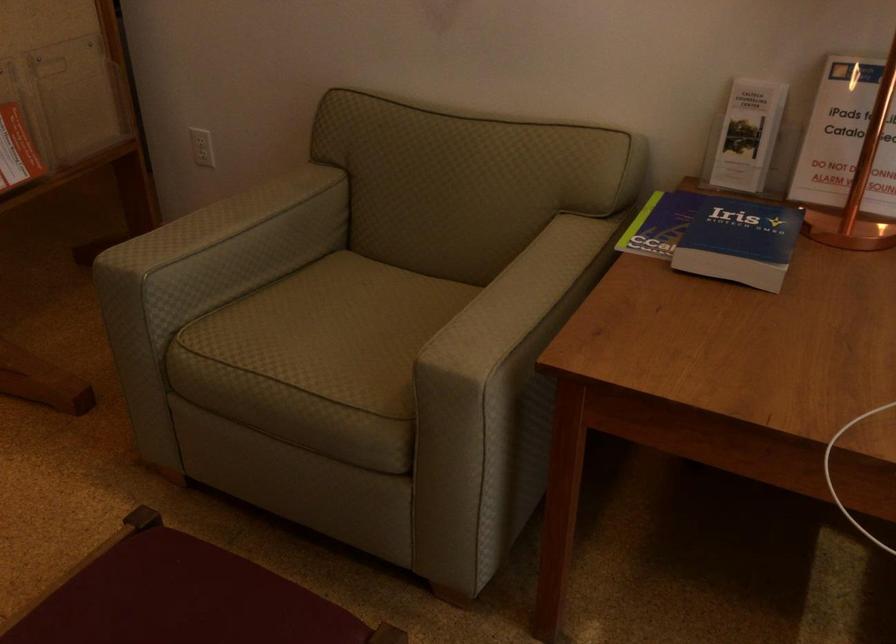
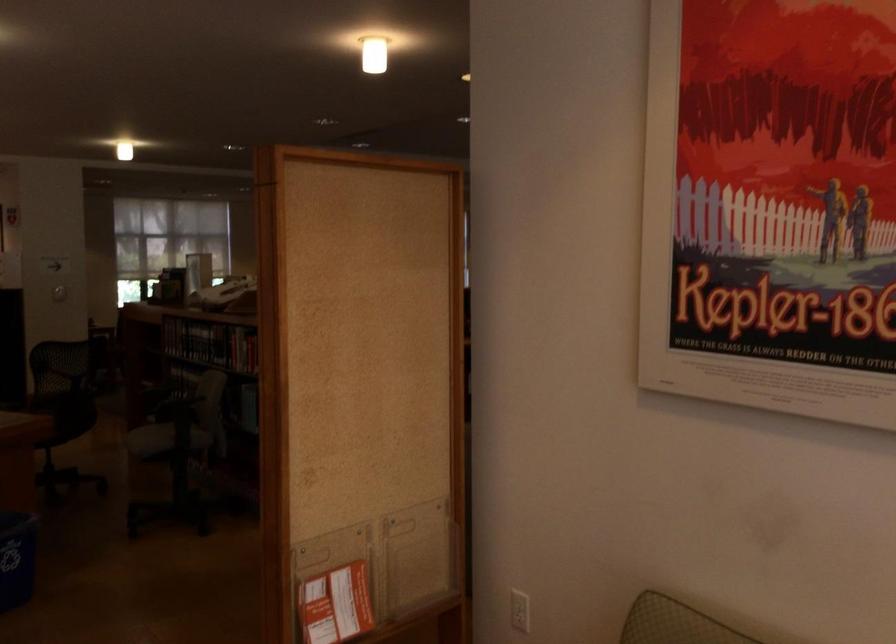
The images are taken continuously from a first-person perspective. In which direction is your viewpoint rotating?

The camera rotated toward left-up.